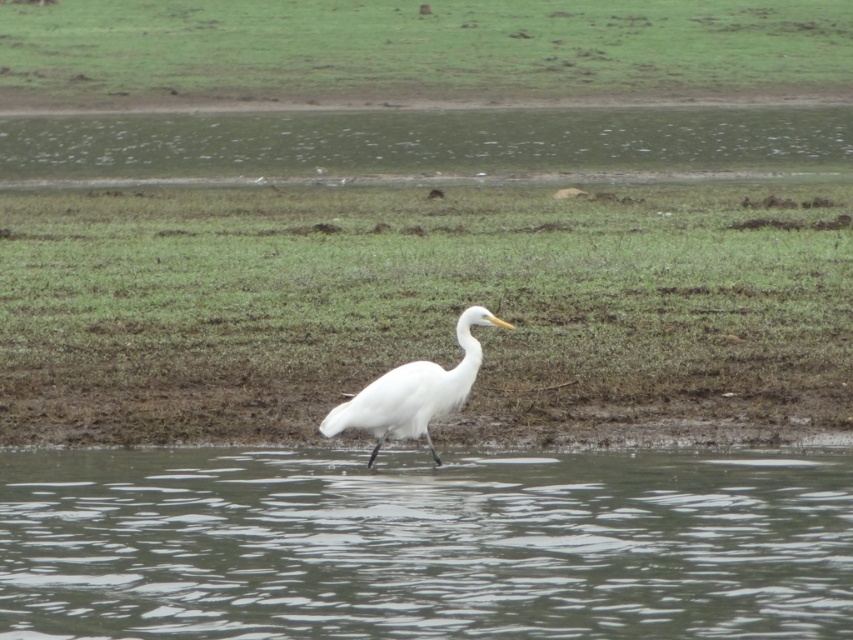
Question: Where is green grass at center located in relation to white feathered bird at center in the image?

Choices:
 (A) left
 (B) right

Answer: (B)

Question: Which point appears farthest from the camera in this image?

Choices:
 (A) (463, 324)
 (B) (601, 467)
 (C) (125, 202)
 (D) (788, 29)

Answer: (D)

Question: Is green grass at center above clear water at lower center?

Choices:
 (A) no
 (B) yes

Answer: (B)

Question: Which object is closer to the camera taking this photo?

Choices:
 (A) white feathered bird at center
 (B) clear water at lower center
 (C) green grass at upper center
 (D) green grass at center

Answer: (B)

Question: From the image, what is the correct spatial relationship of green grass at center in relation to white feathered bird at center?

Choices:
 (A) below
 (B) above

Answer: (B)

Question: Which of the following is the farthest from the observer?

Choices:
 (A) clear water at lower center
 (B) white feathered bird at center
 (C) green grass at center

Answer: (C)